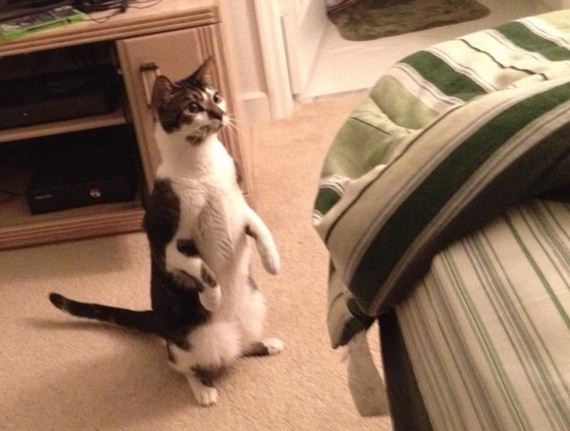
Identify the location of bed. (528, 297).